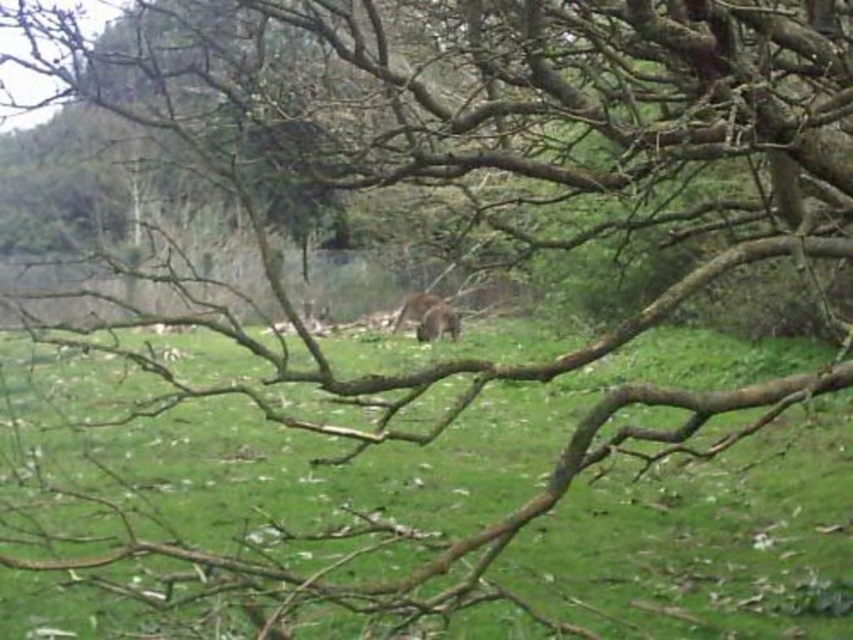
Question: Does green grassy field at center have a smaller size compared to brown furry animal at center?

Choices:
 (A) yes
 (B) no

Answer: (A)

Question: Which point is farther to the camera?

Choices:
 (A) green grassy field at center
 (B) brown furry animal at center

Answer: (B)

Question: Among these points, which one is nearest to the camera?

Choices:
 (A) (799, 540)
 (B) (430, 336)

Answer: (A)

Question: Does green grassy field at center have a lesser width compared to brown furry animal at center?

Choices:
 (A) no
 (B) yes

Answer: (B)

Question: Is green grassy field at center bigger than brown furry animal at center?

Choices:
 (A) no
 (B) yes

Answer: (A)